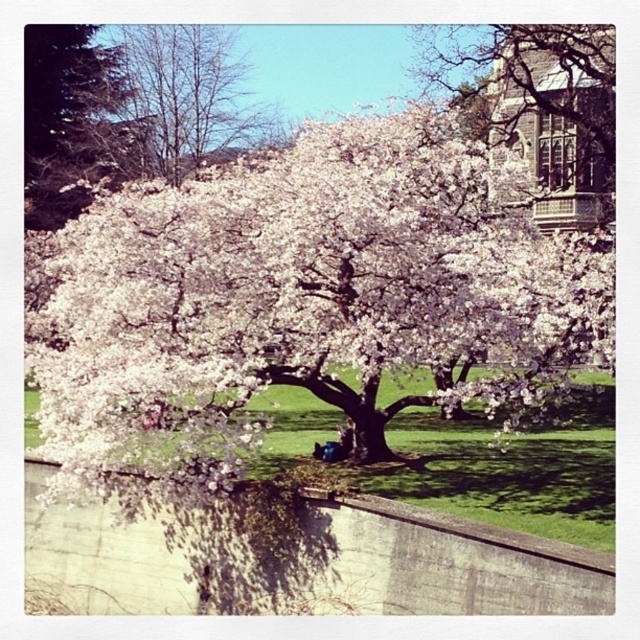
Does white blossoms at center appear on the right side of bare branches at upper left?

Yes, white blossoms at center is to the right of bare branches at upper left.

Is white blossoms at center thinner than bare branches at upper left?

In fact, white blossoms at center might be wider than bare branches at upper left.

Between point (448, 256) and point (166, 42), which one is positioned behind?

The point (166, 42) is more distant.

Image resolution: width=640 pixels, height=640 pixels. What are the coordinates of `white blossoms at center` in the screenshot? It's located at click(x=314, y=296).